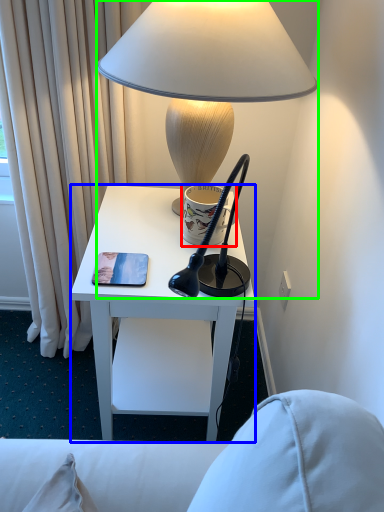
Question: Which object is positioned closest to coffee cup (highlighted by a red box)? Select from desk (highlighted by a blue box) and lamp (highlighted by a green box).

Choices:
 (A) desk
 (B) lamp

Answer: (A)